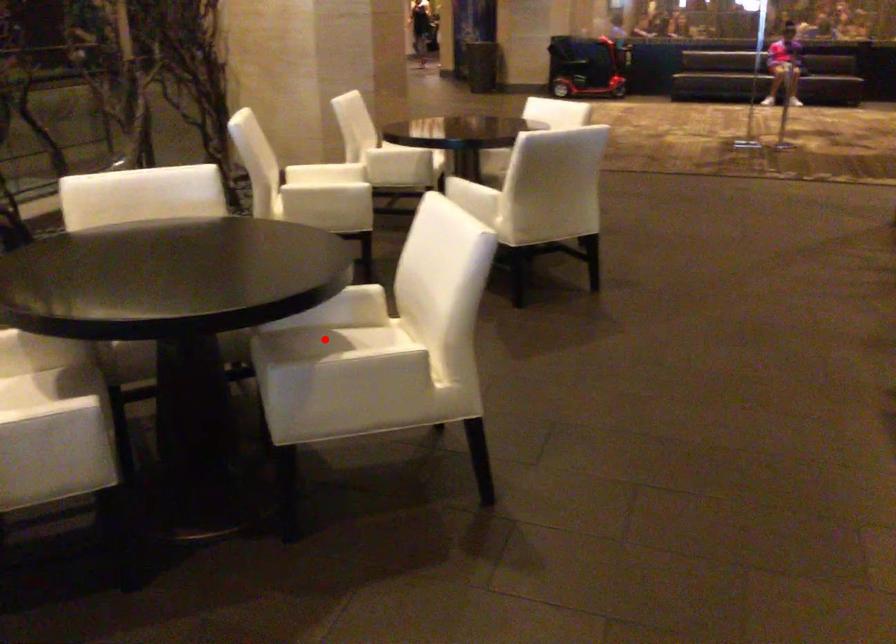
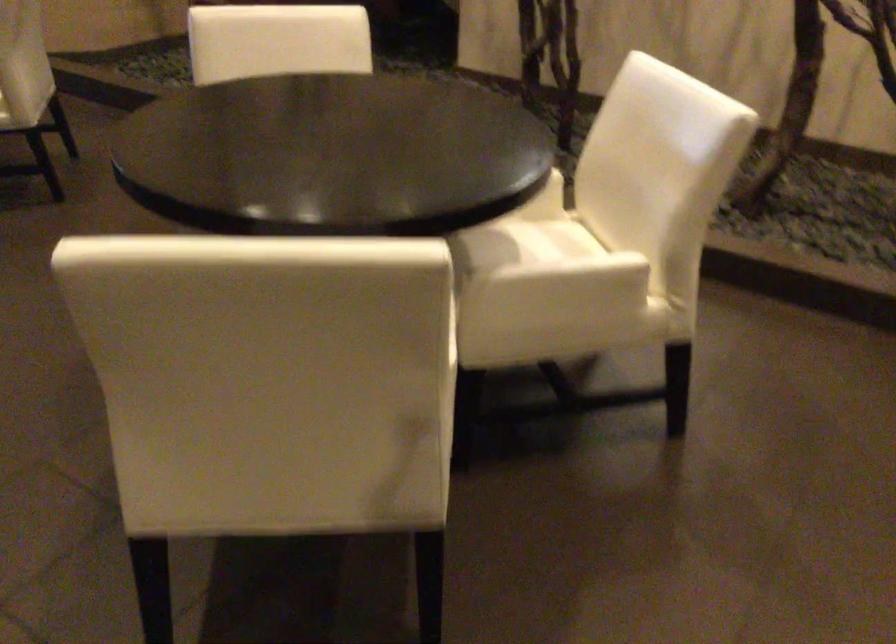
Question: I am providing you with two images of the same scene from different viewpoints. A red point is marked on the first image. Can you still see the location of the red point in image 2?

Choices:
 (A) Yes
 (B) No

Answer: (B)